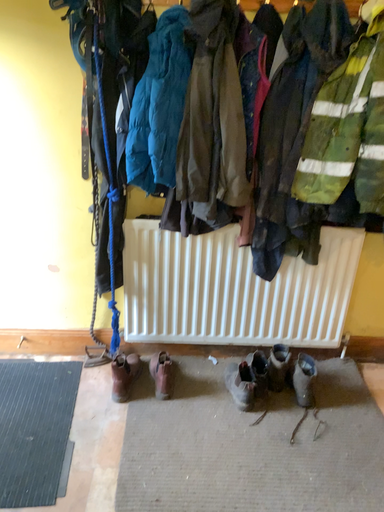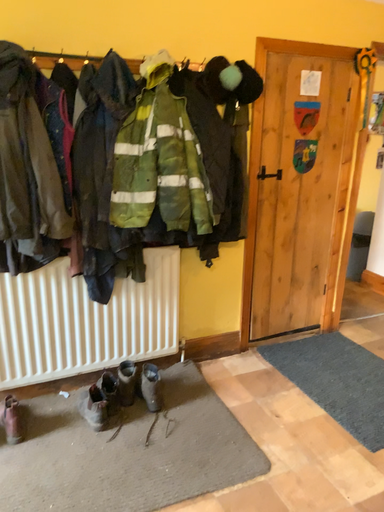
Question: Which way did the camera rotate in the video?

Choices:
 (A) rotated downward
 (B) rotated upward

Answer: (B)